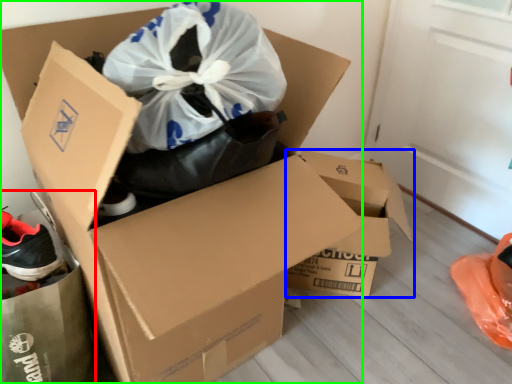
Question: Which object is positioned farthest from garbage (highlighted by a red box)? Select from box (highlighted by a blue box) and box (highlighted by a green box).

Choices:
 (A) box
 (B) box

Answer: (A)